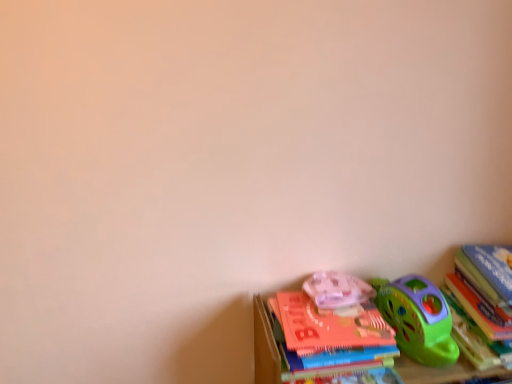
Question: Considering the positions of translucent plastic toy at lower right and hardcover book at right in the image, is translucent plastic toy at lower right taller or shorter than hardcover book at right?

Choices:
 (A) short
 (B) tall

Answer: (A)

Question: From the image's perspective, is translucent plastic toy at lower right positioned above or below hardcover book at right?

Choices:
 (A) above
 (B) below

Answer: (A)

Question: From a real-world perspective, is translucent plastic toy at lower right positioned above or below hardcover book at right?

Choices:
 (A) below
 (B) above

Answer: (B)

Question: Is point (449, 302) closer or farther from the camera than point (330, 299)?

Choices:
 (A) closer
 (B) farther

Answer: (B)

Question: From a real-world perspective, is hardcover book at right above or below translucent plastic toy at lower right?

Choices:
 (A) below
 (B) above

Answer: (A)

Question: Is hardcover book at right wider or thinner than translucent plastic toy at lower right?

Choices:
 (A) thin
 (B) wide

Answer: (B)

Question: From the image's perspective, is hardcover book at right positioned above or below translucent plastic toy at lower right?

Choices:
 (A) above
 (B) below

Answer: (B)